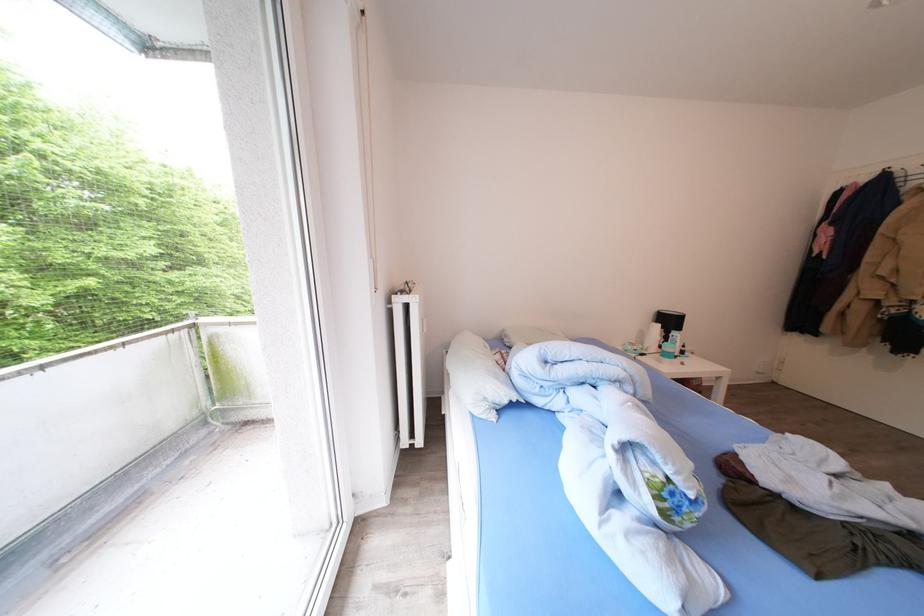
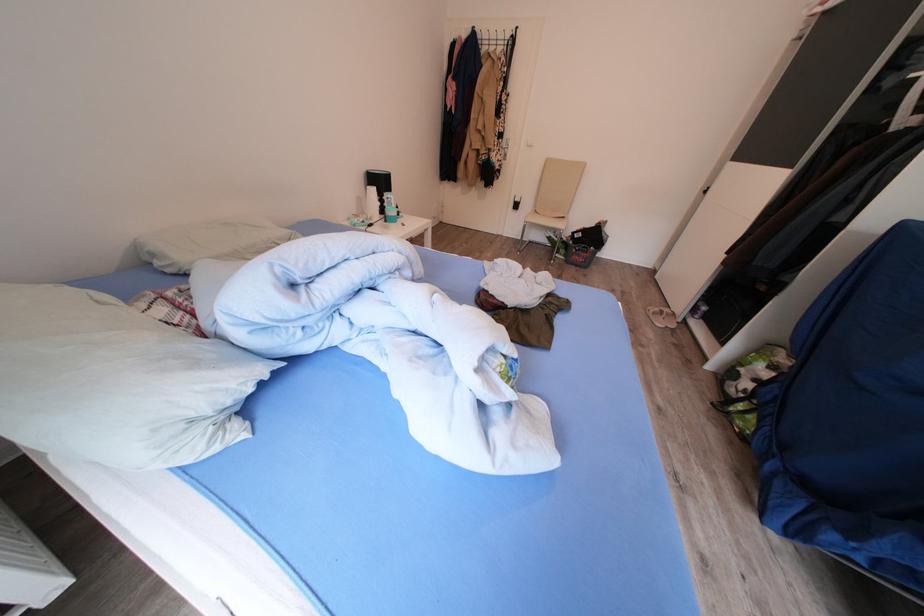
How did the camera likely rotate?

The rotation direction of the camera is right-down.